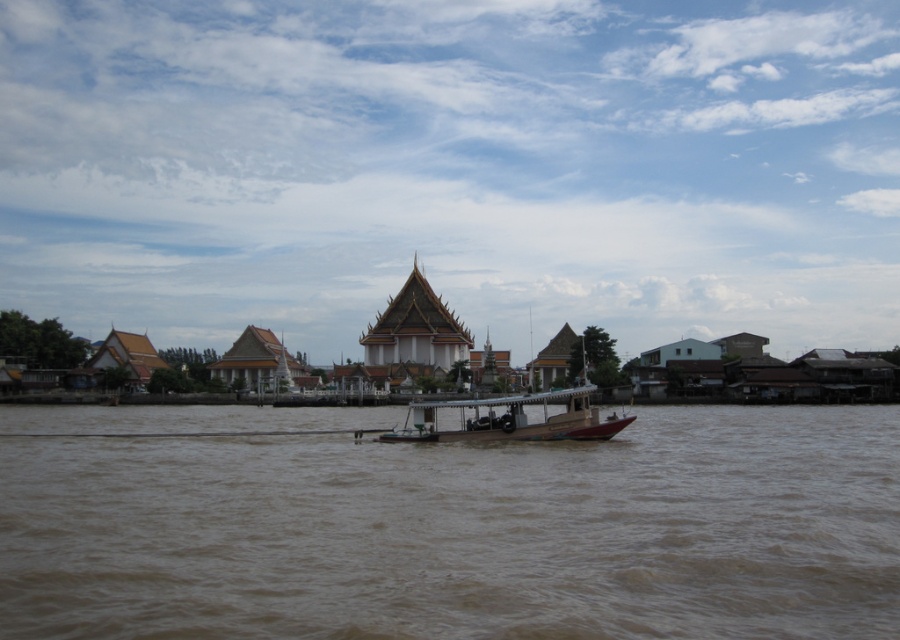
Question: Which object appears farthest from the camera in this image?

Choices:
 (A) golden textured temple at center
 (B) wooden boat at center

Answer: (A)

Question: Is brown muddy water at center wider than golden textured temple at center?

Choices:
 (A) yes
 (B) no

Answer: (A)

Question: Which object appears closest to the camera in this image?

Choices:
 (A) golden textured temple at center
 (B) brown muddy water at center

Answer: (B)

Question: Among these points, which one is farthest from the camera?

Choices:
 (A) (572, 412)
 (B) (421, 339)

Answer: (B)

Question: Can you confirm if brown muddy water at center is thinner than wooden boat at center?

Choices:
 (A) yes
 (B) no

Answer: (B)

Question: Is brown muddy water at center to the right of wooden boat at center from the viewer's perspective?

Choices:
 (A) no
 (B) yes

Answer: (B)